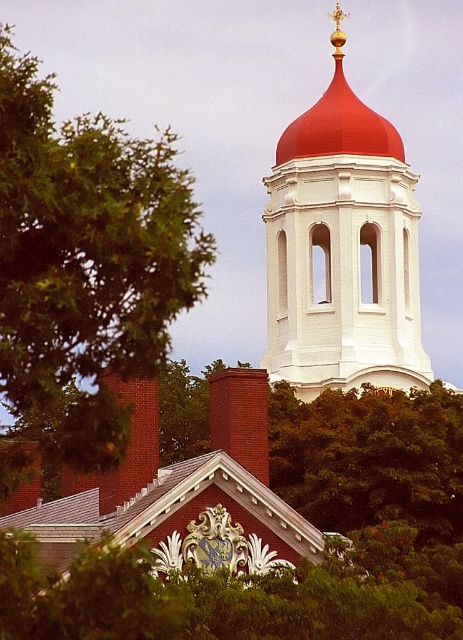
Question: Is green leafy tree at center below matte brick church at center?

Choices:
 (A) no
 (B) yes

Answer: (B)

Question: Observing the image, what is the correct spatial positioning of green leafy tree at left in reference to white smooth tower at upper center?

Choices:
 (A) left
 (B) right

Answer: (A)

Question: Which of the following is the closest to the observer?

Choices:
 (A) (135, 595)
 (B) (275, 180)

Answer: (A)

Question: Is white smooth tower at upper center positioned in front of matte brick church at center?

Choices:
 (A) no
 (B) yes

Answer: (A)

Question: Which object is positioned farthest from the brick chimney at center?

Choices:
 (A) green leafy tree at center
 (B) brick chimney at center-left
 (C) green leafy tree at left
 (D) white smooth tower at upper center

Answer: (D)

Question: Which point is closer to the camera?

Choices:
 (A) (118, 470)
 (B) (227, 397)

Answer: (A)